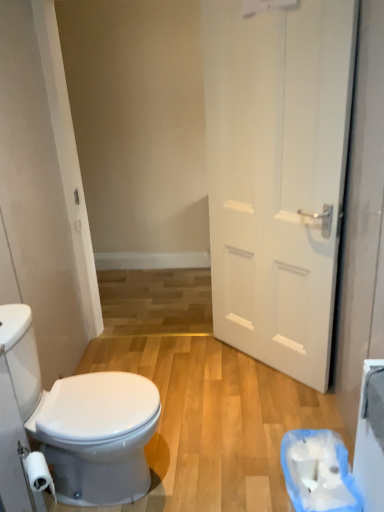
Question: Is white matte toilet paper at lower left, arranged as the 2th toilet paper when viewed from the back, wider than white glossy bidet at lower left?

Choices:
 (A) no
 (B) yes

Answer: (A)

Question: Is white matte toilet paper at lower left, which appears as the 1th toilet paper when viewed from the front, facing towards white glossy bidet at lower left?

Choices:
 (A) yes
 (B) no

Answer: (B)

Question: Is white matte toilet paper at lower left, arranged as the 2th toilet paper when viewed from the back, placed right next to white glossy bidet at lower left?

Choices:
 (A) no
 (B) yes

Answer: (A)

Question: Would you say white glossy bidet at lower left is part of white matte toilet paper at lower left, the first toilet paper when ordered from left to right,'s contents?

Choices:
 (A) no
 (B) yes

Answer: (A)

Question: Can you confirm if white matte toilet paper at lower left, the first toilet paper when ordered from left to right, is shorter than white glossy bidet at lower left?

Choices:
 (A) yes
 (B) no

Answer: (A)

Question: From their relative heights in the image, would you say white matte toilet paper at lower left, the first toilet paper when ordered from left to right, is taller or shorter than white matte door at right?

Choices:
 (A) short
 (B) tall

Answer: (A)

Question: From a real-world perspective, relative to white matte door at right, is white matte toilet paper at lower left, which appears as the 1th toilet paper when viewed from the front, vertically above or below?

Choices:
 (A) above
 (B) below

Answer: (B)

Question: Which is correct: white matte toilet paper at lower left, the 2th toilet paper in the right-to-left sequence, is inside white matte door at right, or outside of it?

Choices:
 (A) inside
 (B) outside

Answer: (B)

Question: Based on their sizes in the image, would you say white matte toilet paper at lower left, the first toilet paper when ordered from left to right, is bigger or smaller than white matte door at right?

Choices:
 (A) small
 (B) big

Answer: (A)

Question: Is white matte toilet paper at lower left, the first toilet paper when ordered from left to right, to the left or to the right of white glossy bidet at lower left in the image?

Choices:
 (A) left
 (B) right

Answer: (A)

Question: Looking at their shapes, would you say white matte toilet paper at lower left, arranged as the 2th toilet paper when viewed from the back, is wider or thinner than white glossy bidet at lower left?

Choices:
 (A) wide
 (B) thin

Answer: (B)

Question: Considering the positions of point (43, 458) and point (112, 448), is point (43, 458) closer or farther from the camera than point (112, 448)?

Choices:
 (A) farther
 (B) closer

Answer: (B)

Question: Looking at the image, does white matte toilet paper at lower left, the 2th toilet paper in the right-to-left sequence, seem bigger or smaller compared to white glossy bidet at lower left?

Choices:
 (A) small
 (B) big

Answer: (A)

Question: From their relative heights in the image, would you say white matte door at right is taller or shorter than white glossy bidet at lower left?

Choices:
 (A) tall
 (B) short

Answer: (A)

Question: Considering their positions, is white matte door at right located in front of or behind white glossy bidet at lower left?

Choices:
 (A) front
 (B) behind

Answer: (B)